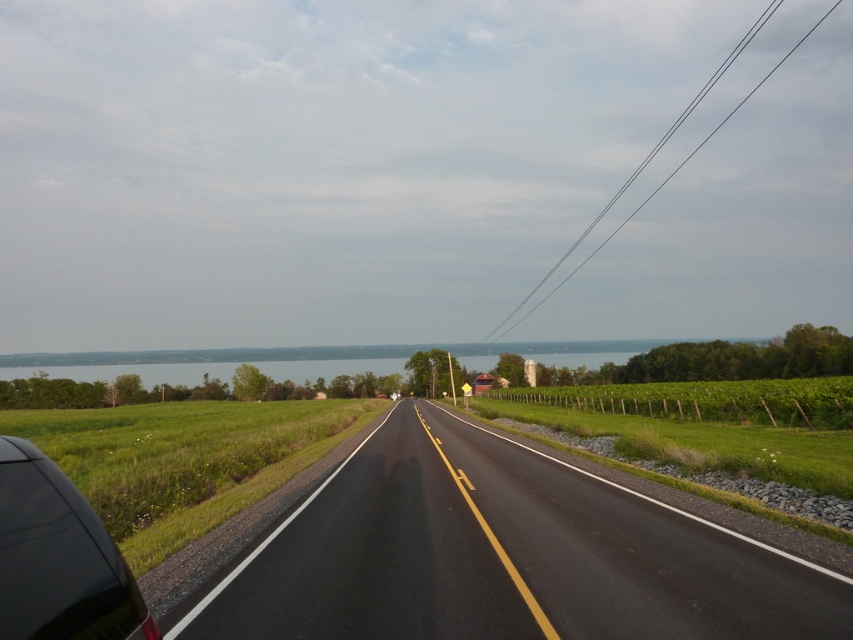
Is point (553, 493) closer to camera compared to point (57, 490)?

Yes, point (553, 493) is in front of point (57, 490).

Which is behind, point (361, 445) or point (74, 592)?

The point (361, 445) is behind.

In order to click on black asphalt highway at center in this screenshot , I will do `click(503, 556)`.